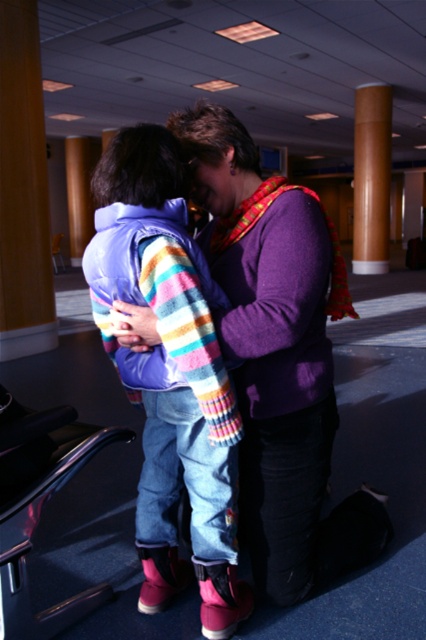
Question: Which object is closer to the camera taking this photo?

Choices:
 (A) purple soft sweater at center
 (B) rainbow striped sweater at center
 (C) brown wooden chair at center

Answer: (B)

Question: Which object is farther from the camera taking this photo?

Choices:
 (A) rainbow striped sweater at center
 (B) brown wooden chair at center

Answer: (B)

Question: Can you confirm if rainbow striped sweater at center is positioned below brown wooden chair at center?

Choices:
 (A) no
 (B) yes

Answer: (B)

Question: Is rainbow striped sweater at center behind metallic black chair at lower left?

Choices:
 (A) yes
 (B) no

Answer: (B)

Question: Which object appears farthest from the camera in this image?

Choices:
 (A) brown wooden chair at center
 (B) rainbow striped sweater at center

Answer: (A)

Question: Can you confirm if purple soft sweater at center is positioned to the right of brown wooden chair at center?

Choices:
 (A) no
 (B) yes

Answer: (B)